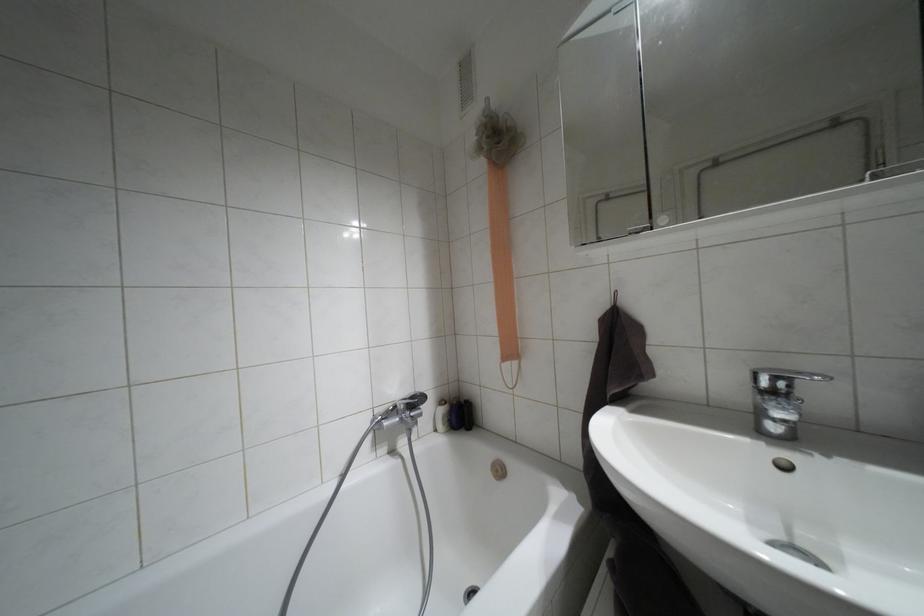
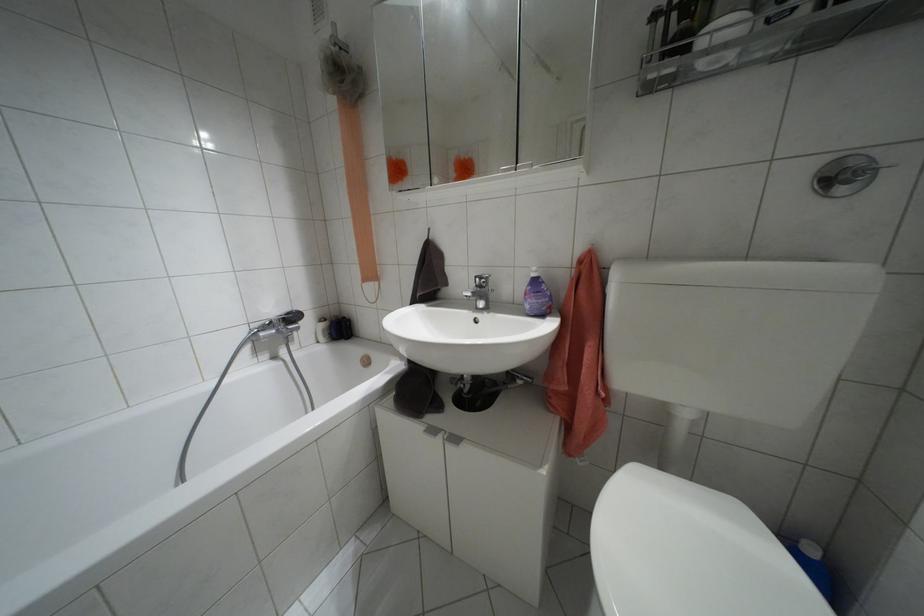
Find the pixel in the second image that matches (x=772, y=392) in the first image.

(479, 286)